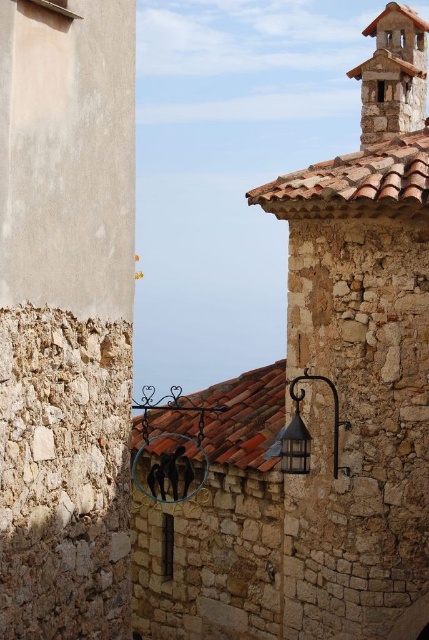
Question: Which point is farther to the camera?

Choices:
 (A) (293, 428)
 (B) (365, 177)
 (C) (404, 109)

Answer: (C)

Question: Is brown clay tiles at upper right smaller than stone bell tower at upper right?

Choices:
 (A) no
 (B) yes

Answer: (A)

Question: Can you confirm if brown clay tiles at upper right is wider than matte black lantern at center?

Choices:
 (A) yes
 (B) no

Answer: (A)

Question: Observing the image, what is the correct spatial positioning of brown clay tiles at upper right in reference to matte black lantern at center?

Choices:
 (A) right
 (B) left

Answer: (A)

Question: Among these objects, which one is farthest from the camera?

Choices:
 (A) brown tile roof at center
 (B) matte black lantern at center

Answer: (B)

Question: Which point is closer to the camera?

Choices:
 (A) brown clay tiles at upper right
 (B) matte black lantern at center
 (C) stone bell tower at upper right

Answer: (A)